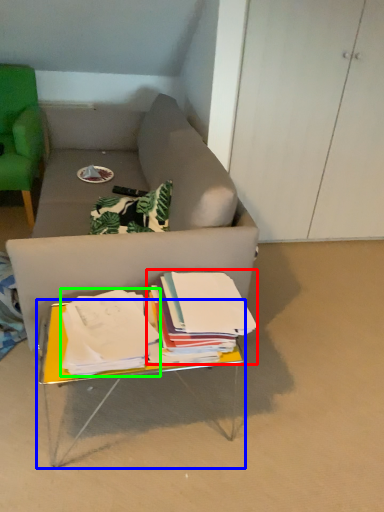
Question: Estimate the real-world distances between objects in this image. Which object is closer to paperback book (highlighted by a red box), table (highlighted by a blue box) or paperback book (highlighted by a green box)?

Choices:
 (A) table
 (B) paperback book

Answer: (B)